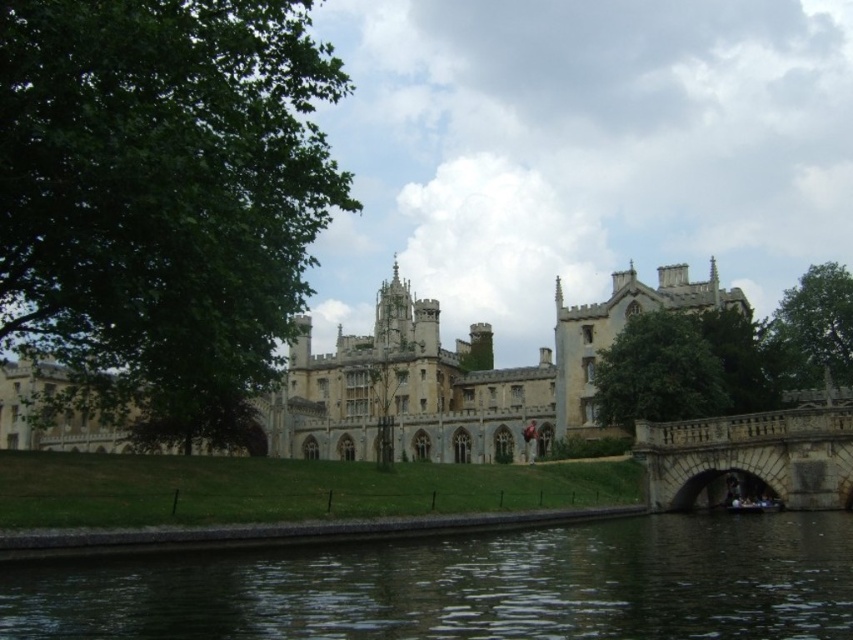
You are a landscape architect designing a walking path between the green leafy tree at center and the green leafy tree at upper right. What is the minimum length of the path needed to connect them directly?

The green leafy tree at center and green leafy tree at upper right are 14.03 meters apart, so the minimum length of the path needed to connect them directly is 14.03 meters.

You are standing on the stone bridge looking towards the historic building. There are two points marked on the bridge. One is at coordinate point(753, 426) and the other at point(666, 410). Which point is closer to you?

Point(753, 426) is closer to the viewer than point(666, 410).

You are a visitor standing on the stone textured bridge at lower right and want to take a photo of the green leafy tree at center. Since the bridge is part of the historic building, will the bridge appear shorter than the tree in your photo?

Yes, the stone textured bridge at lower right is shorter than the green leafy tree at center, so in the photo, the bridge will appear shorter than the tree.